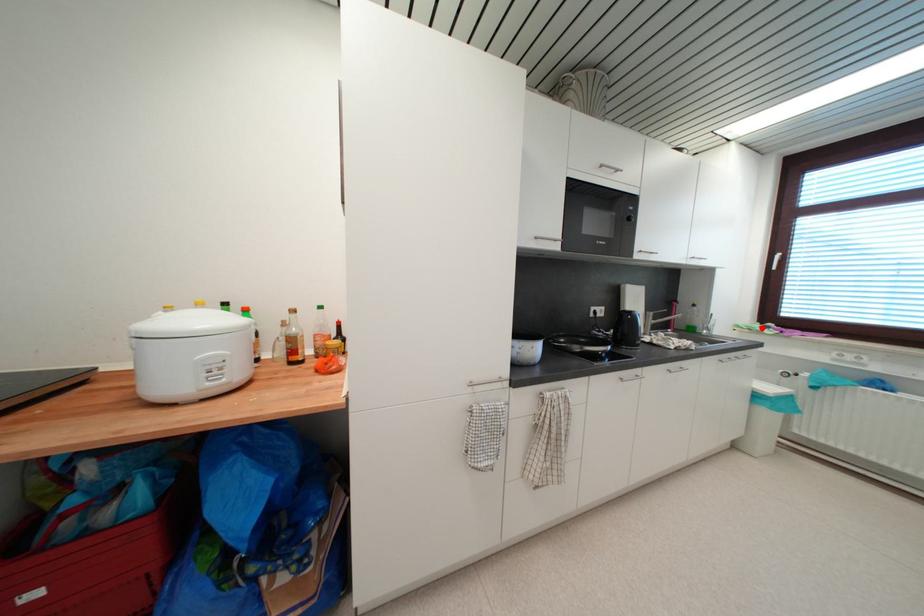
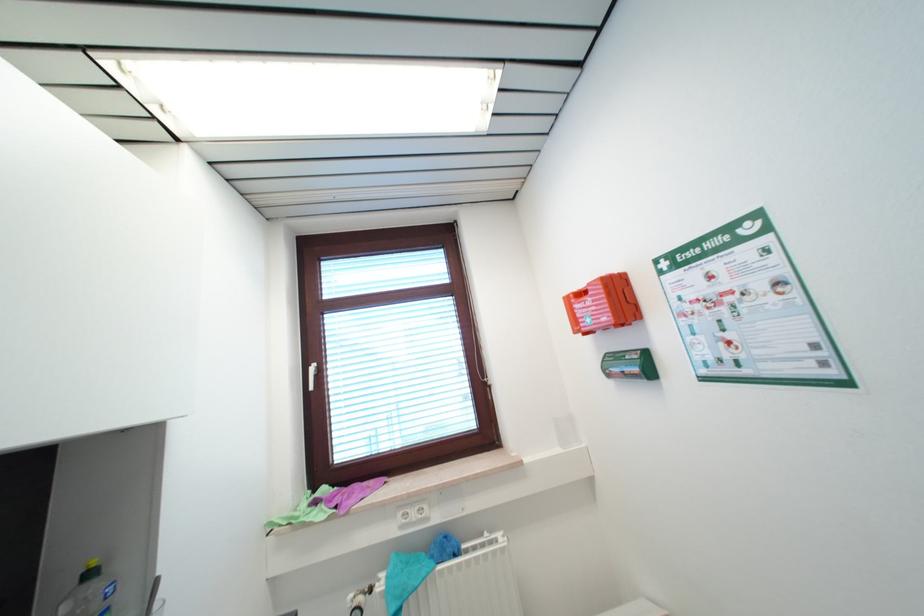
Where in the second image is the point corresponding to the highlighted location from the first image?

(311, 501)